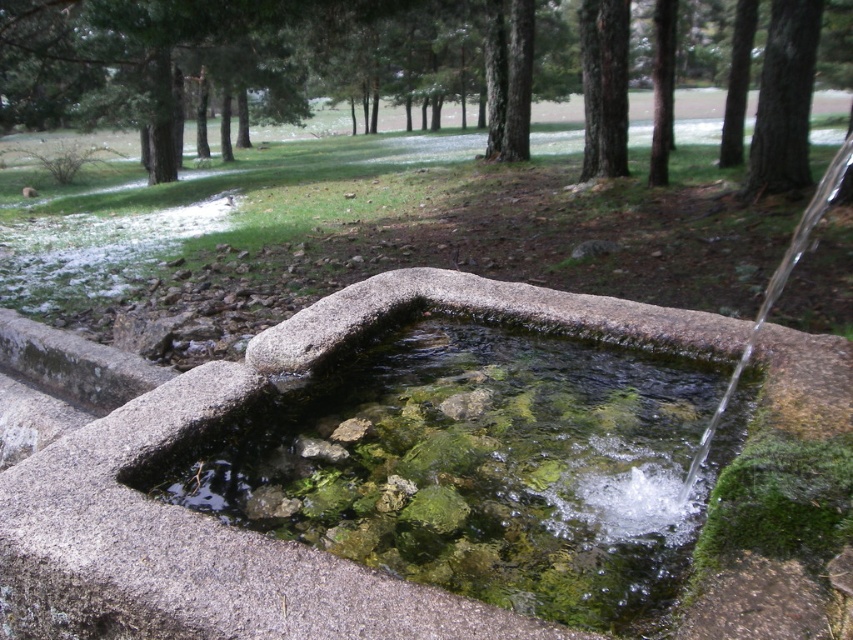
Is green leafy tree at upper center smaller than dark brown bark tree at upper right?

Actually, green leafy tree at upper center might be larger than dark brown bark tree at upper right.

Does green leafy tree at upper center have a greater height compared to dark brown bark tree at upper right?

Correct, green leafy tree at upper center is much taller as dark brown bark tree at upper right.

Who is more distant from viewer, (616, 138) or (767, 122)?

The point (616, 138) is behind.

Locate an element on the screen. This screenshot has height=640, width=853. green leafy tree at upper center is located at coordinates (320, 60).

Is dark brown bark tree at upper right to the right of green mossy tree at upper center from the viewer's perspective?

In fact, dark brown bark tree at upper right is to the left of green mossy tree at upper center.

Is point (773, 54) positioned after point (724, 164)?

That is False.

Is point (798, 173) in front of point (724, 160)?

Yes, it is in front of point (724, 160).

Where is `dark brown bark tree at upper right`? The image size is (853, 640). dark brown bark tree at upper right is located at coordinates (784, 100).

Consider the image. Is green leafy tree at upper center thinner than green mossy tree at upper center?

In fact, green leafy tree at upper center might be wider than green mossy tree at upper center.

Does green leafy tree at upper center have a larger size compared to green mossy tree at upper center?

Indeed, green leafy tree at upper center has a larger size compared to green mossy tree at upper center.

Is point (341, 86) positioned after point (753, 20)?

That is True.

I want to click on green leafy tree at upper center, so click(x=320, y=60).